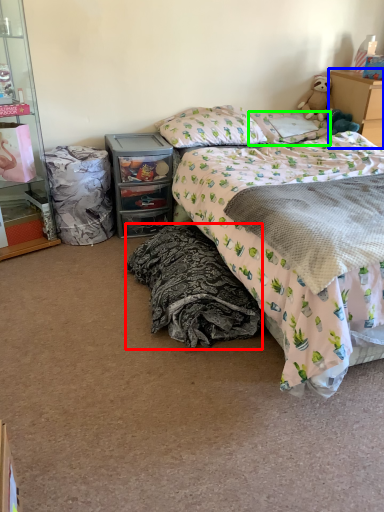
Question: Considering the real-world distances, which object is closest to blanket (highlighted by a red box)? chest of drawers (highlighted by a blue box) or pillow (highlighted by a green box).

Choices:
 (A) chest of drawers
 (B) pillow

Answer: (B)